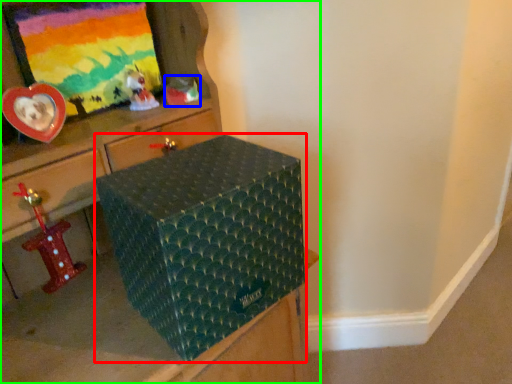
Question: Estimate the real-world distances between objects in this image. Which object is closer to box (highlighted by a red box), toy (highlighted by a blue box) or furniture (highlighted by a green box)?

Choices:
 (A) toy
 (B) furniture

Answer: (B)